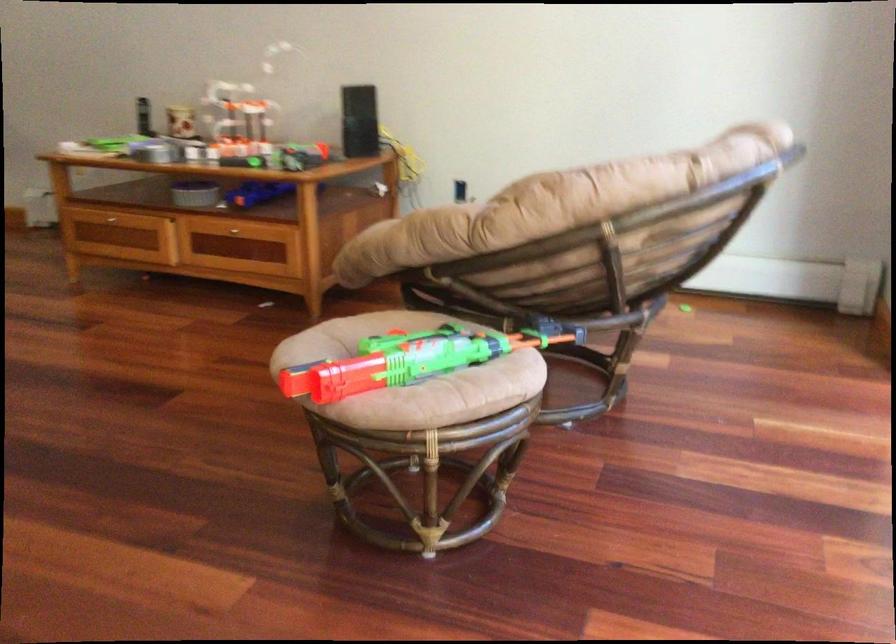
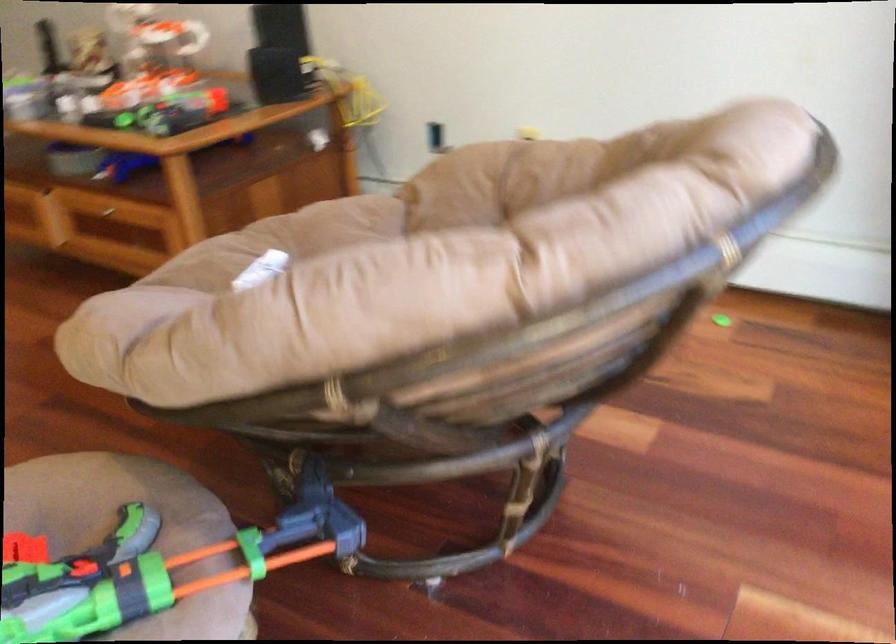
Find the pixel in the second image that matches [471,328] in the first image.

(134, 527)